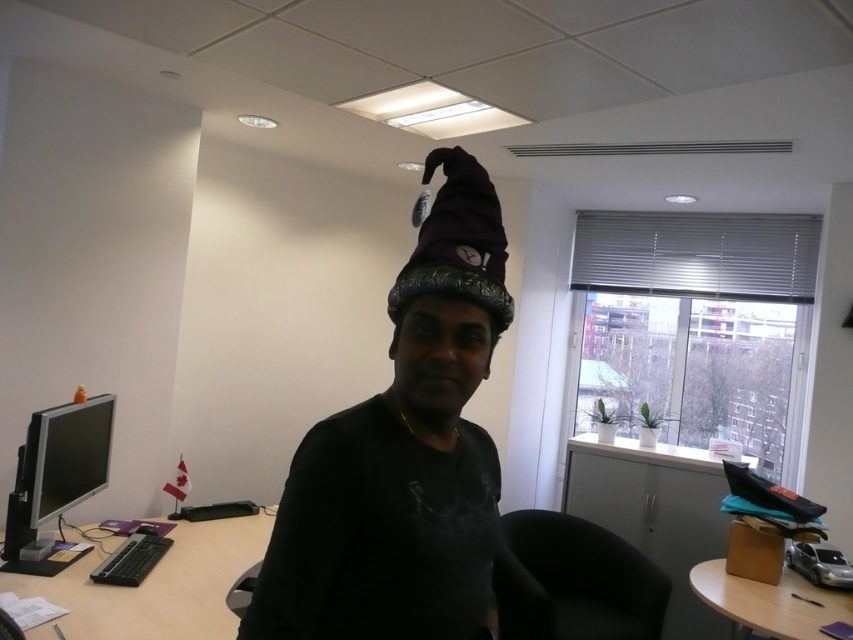
You are organizing a desk and need to place a large document organizer that requires more space than the matte black monitor at left. Based on the scene, can the black plastic computer desk at lower left accommodate it?

The black plastic computer desk at lower left is bigger than the matte black monitor at left, so it can accommodate the large document organizer that requires more space than the matte black monitor at left.

You are organizing a desk space and need to place a new keyboard. The black plastic computer desk at lower left and the matte black monitor at left are in your view. Which object has a greater width to accommodate the keyboard?

The black plastic computer desk at lower left has a greater width than the matte black monitor at left, so it can accommodate the keyboard better.